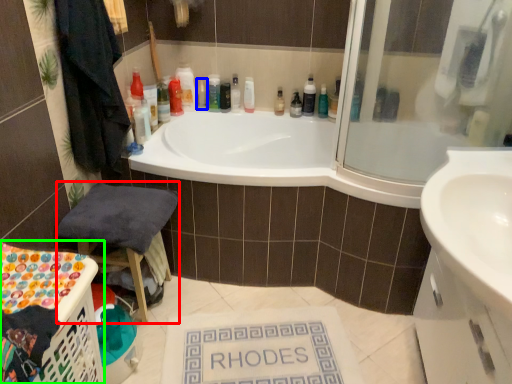
Question: Which object is the closest to the chair (highlighted by a red box)? Choose among these: toiletry (highlighted by a blue box) or laundry basket (highlighted by a green box).

Choices:
 (A) toiletry
 (B) laundry basket

Answer: (B)